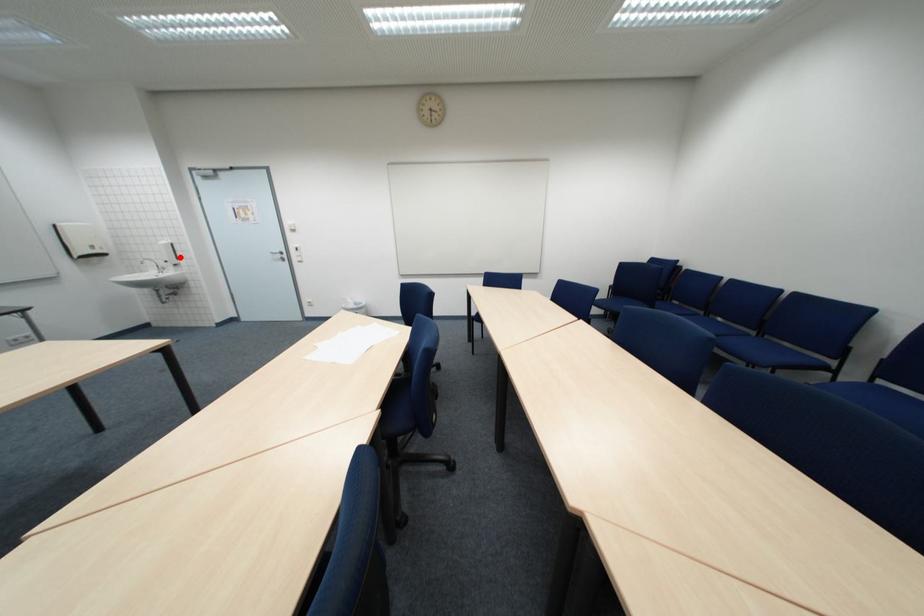
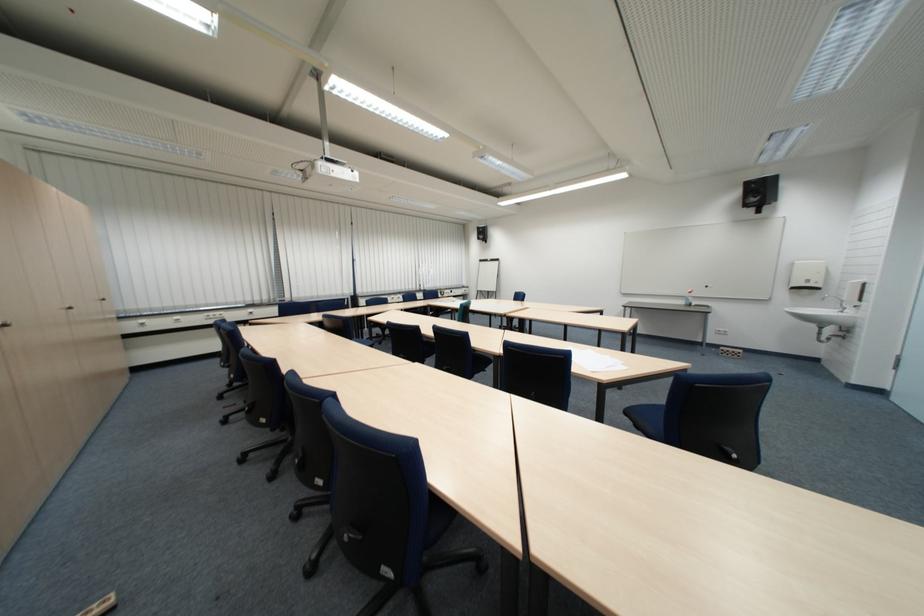
Question: I am providing you with two images of the same scene from different viewpoints. Given a red point in image1, look at the same physical point in image2. Is it:

Choices:
 (A) Closer to the viewpoint
 (B) Farther from the viewpoint

Answer: (B)